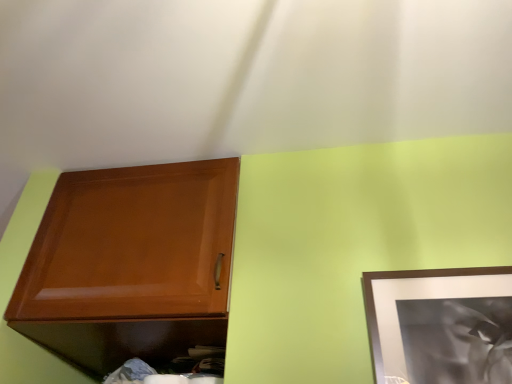
Question: Are matte silver picture frame at upper right and glossy wood cabinet at upper left far apart?

Choices:
 (A) yes
 (B) no

Answer: (B)

Question: Would you say matte silver picture frame at upper right is outside glossy wood cabinet at upper left?

Choices:
 (A) no
 (B) yes

Answer: (B)

Question: From the image's perspective, is matte silver picture frame at upper right beneath glossy wood cabinet at upper left?

Choices:
 (A) no
 (B) yes

Answer: (A)

Question: Is matte silver picture frame at upper right positioned behind glossy wood cabinet at upper left?

Choices:
 (A) yes
 (B) no

Answer: (B)

Question: From the image's perspective, is matte silver picture frame at upper right on top of glossy wood cabinet at upper left?

Choices:
 (A) no
 (B) yes

Answer: (B)

Question: Considering the relative sizes of matte silver picture frame at upper right and glossy wood cabinet at upper left in the image provided, is matte silver picture frame at upper right wider than glossy wood cabinet at upper left?

Choices:
 (A) yes
 (B) no

Answer: (B)

Question: From the image's perspective, is glossy wood cabinet at upper left beneath matte silver picture frame at upper right?

Choices:
 (A) yes
 (B) no

Answer: (A)

Question: Considering the relative sizes of glossy wood cabinet at upper left and matte silver picture frame at upper right in the image provided, is glossy wood cabinet at upper left bigger than matte silver picture frame at upper right?

Choices:
 (A) no
 (B) yes

Answer: (B)

Question: Is glossy wood cabinet at upper left far away from matte silver picture frame at upper right?

Choices:
 (A) no
 (B) yes

Answer: (A)

Question: From the image's perspective, is glossy wood cabinet at upper left located above matte silver picture frame at upper right?

Choices:
 (A) no
 (B) yes

Answer: (A)

Question: Considering the relative sizes of glossy wood cabinet at upper left and matte silver picture frame at upper right in the image provided, is glossy wood cabinet at upper left thinner than matte silver picture frame at upper right?

Choices:
 (A) yes
 (B) no

Answer: (B)

Question: Considering the relative sizes of glossy wood cabinet at upper left and matte silver picture frame at upper right in the image provided, is glossy wood cabinet at upper left shorter than matte silver picture frame at upper right?

Choices:
 (A) yes
 (B) no

Answer: (B)

Question: Looking at their shapes, would you say matte silver picture frame at upper right is wider or thinner than glossy wood cabinet at upper left?

Choices:
 (A) thin
 (B) wide

Answer: (A)